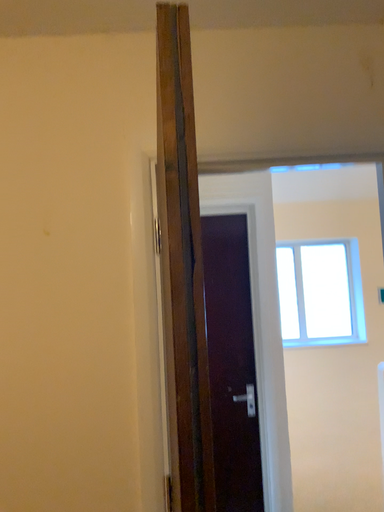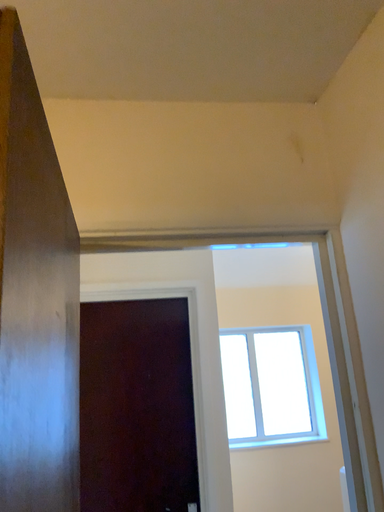
Question: How did the camera likely rotate when shooting the video?

Choices:
 (A) rotated downward
 (B) rotated upward

Answer: (B)